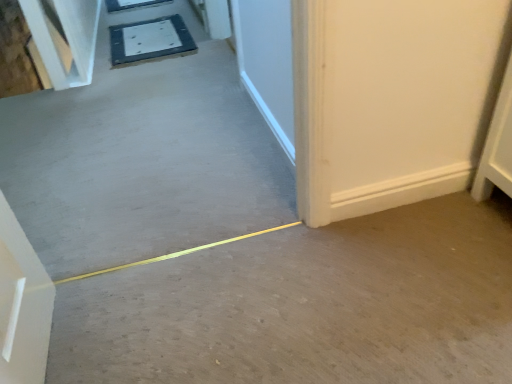
The width and height of the screenshot is (512, 384). What are the coordinates of `gray concrete at lower center` in the screenshot? It's located at (306, 306).

The height and width of the screenshot is (384, 512). Describe the element at coordinates (306, 306) in the screenshot. I see `gray concrete at lower center` at that location.

I want to click on gray concrete at lower center, so click(306, 306).